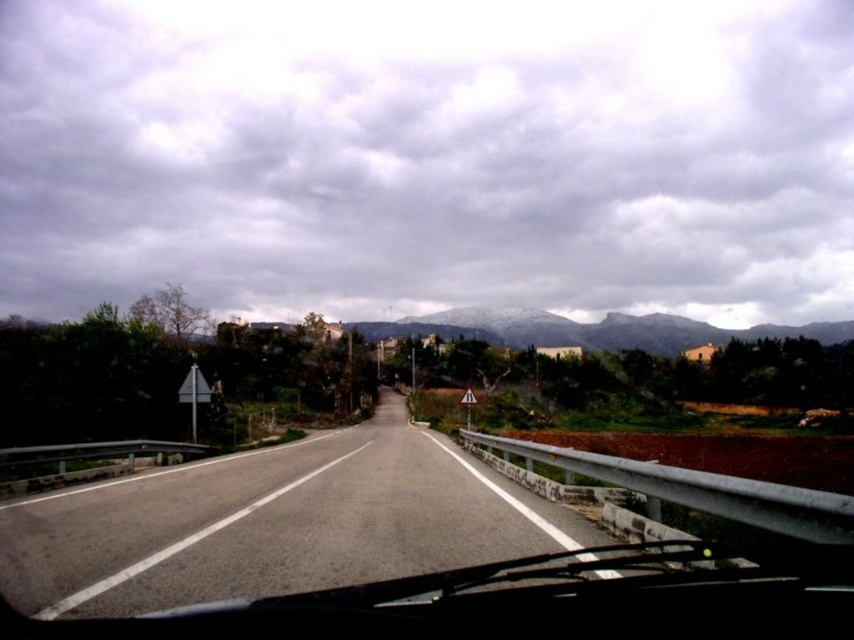
Between cloudy sky at upper center and snow-covered rock formation at center, which one is positioned lower?

Positioned lower is snow-covered rock formation at center.

Is cloudy sky at upper center above snow-covered rock formation at center?

Yes.

Which is behind, point (373, 19) or point (487, 312)?

Positioned behind is point (373, 19).

You are a GUI agent. You are given a task and a screenshot of the screen. Output one action in this format:
    pyautogui.click(x=<x>, y=<y>)
    Task: Click on the cloudy sky at upper center
    This screenshot has height=640, width=854.
    Given the screenshot: What is the action you would take?
    pyautogui.click(x=430, y=156)

Between asphalt road at center and snow-covered rock formation at center, which one has less height?

asphalt road at center

Is point (530, 552) positioned before point (471, 330)?

Yes, it is.

Describe the element at coordinates (273, 524) in the screenshot. I see `asphalt road at center` at that location.

This screenshot has width=854, height=640. I want to click on asphalt road at center, so click(273, 524).

Describe the element at coordinates (430, 156) in the screenshot. I see `cloudy sky at upper center` at that location.

Is cloudy sky at upper center positioned at the back of asphalt road at center?

Yes, cloudy sky at upper center is behind asphalt road at center.

Does point (20, 131) come behind point (322, 560)?

Yes, point (20, 131) is behind point (322, 560).

Locate an element on the screen. The height and width of the screenshot is (640, 854). cloudy sky at upper center is located at coordinates (430, 156).